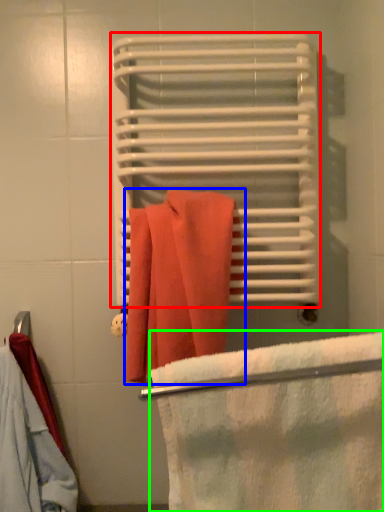
Question: Considering the real-world distances, which object is farthest from bath towel (highlighted by a red box)? towel (highlighted by a blue box) or beach towel (highlighted by a green box)?

Choices:
 (A) towel
 (B) beach towel

Answer: (B)